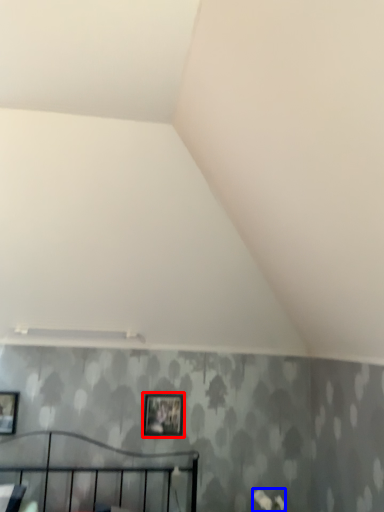
Question: Which of the following is the closest to the observer, picture frame (highlighted by a red box) or flower (highlighted by a blue box)?

Choices:
 (A) picture frame
 (B) flower

Answer: (B)